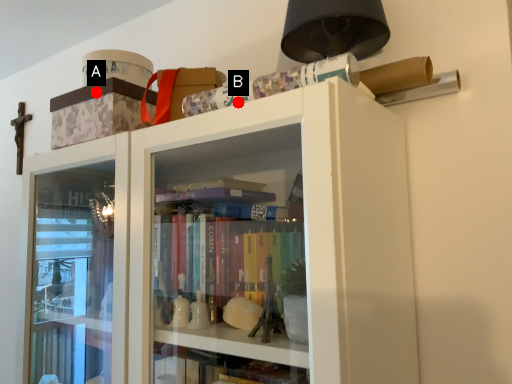
Question: Two points are circled on the image, labeled by A and B beside each circle. Which point is farther to the camera?

Choices:
 (A) A is further
 (B) B is further

Answer: (A)